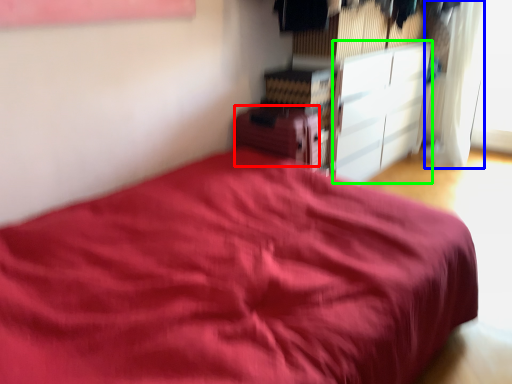
Question: Based on their relative distances, which object is farther from cabinetry (highlighted by a red box)? Choose from curtain (highlighted by a blue box) and cabinetry (highlighted by a green box).

Choices:
 (A) curtain
 (B) cabinetry

Answer: (A)